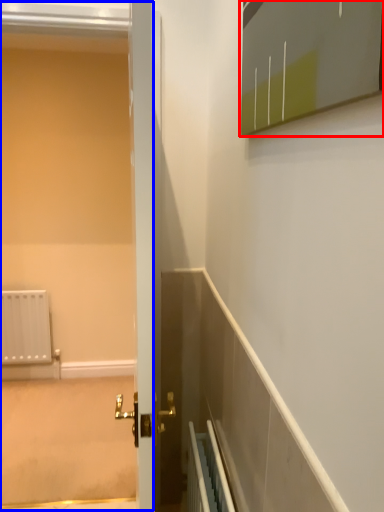
Question: Which point is closer to the camera, medicine cabinet (highlighted by a red box) or screen door (highlighted by a blue box)?

Choices:
 (A) medicine cabinet
 (B) screen door

Answer: (A)